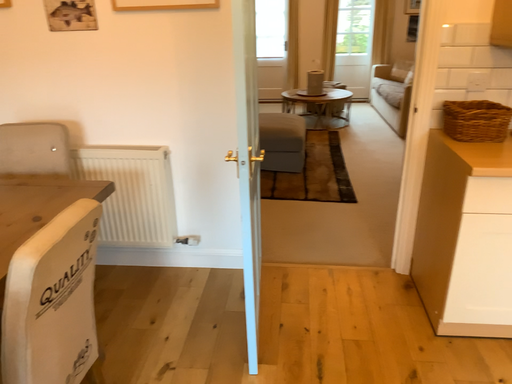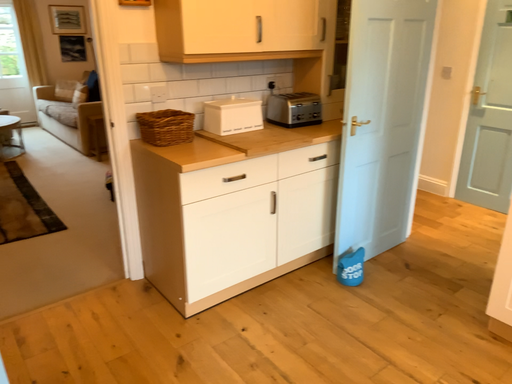
Question: How did the camera likely rotate when shooting the video?

Choices:
 (A) rotated upward
 (B) rotated downward

Answer: (A)